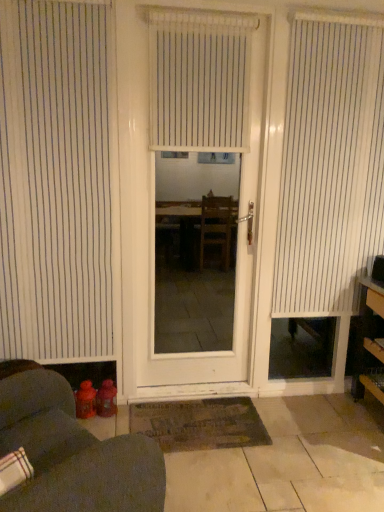
Describe the element at coordinates (330, 166) in the screenshot. I see `white vertical blinds at right, the 3th window blind positioned from the left` at that location.

Where is `white striped blind at lower left, arranged as the third window blind when viewed from the right`? This screenshot has width=384, height=512. white striped blind at lower left, arranged as the third window blind when viewed from the right is located at coordinates (55, 180).

Describe the element at coordinates (369, 341) in the screenshot. Image resolution: width=384 pixels, height=512 pixels. I see `wooden shelves at right` at that location.

What do you see at coordinates (71, 451) in the screenshot?
I see `matte red water bottles at lower left` at bounding box center [71, 451].

Locate an element on the screen. Image resolution: width=384 pixels, height=512 pixels. white vertical blinds at right, the 3th window blind positioned from the left is located at coordinates (330, 166).

Is white vertical blinds at center, the second window blind in the right-to-left sequence, at the right side of dark brown textured mat at center?

Correct, you'll find white vertical blinds at center, the second window blind in the right-to-left sequence, to the right of dark brown textured mat at center.

Is white vertical blinds at center, which ranks as the second window blind in left-to-right order, closer to camera compared to dark brown textured mat at center?

Yes, white vertical blinds at center, which ranks as the second window blind in left-to-right order, is closer to the camera.

From the image's perspective, is white vertical blinds at center, the second window blind in the right-to-left sequence, positioned above or below dark brown textured mat at center?

white vertical blinds at center, the second window blind in the right-to-left sequence, is situated higher than dark brown textured mat at center in the image.

Which is in front, point (199, 122) or point (198, 418)?

Point (199, 122)

Does white matte door at center turn towards white vertical blinds at right, which ranks as the 1th window blind in right-to-left order?

No.

Does point (162, 158) appear closer or farther from the camera than point (361, 21)?

Clearly, point (162, 158) is more distant from the camera than point (361, 21).

Considering the relative sizes of white matte door at center and white vertical blinds at right, which ranks as the 1th window blind in right-to-left order, in the image provided, is white matte door at center thinner than white vertical blinds at right, which ranks as the 1th window blind in right-to-left order,?

Yes.

Can you confirm if dark brown textured mat at center is positioned to the left of white striped blind at lower left, arranged as the third window blind when viewed from the right?

Incorrect, dark brown textured mat at center is not on the left side of white striped blind at lower left, arranged as the third window blind when viewed from the right.

From their relative heights in the image, would you say dark brown textured mat at center is taller or shorter than white striped blind at lower left, arranged as the third window blind when viewed from the right?

dark brown textured mat at center is shorter than white striped blind at lower left, arranged as the third window blind when viewed from the right.

Considering their positions, is dark brown textured mat at center located in front of or behind white striped blind at lower left, arranged as the third window blind when viewed from the right?

Visually, dark brown textured mat at center is located behind white striped blind at lower left, arranged as the third window blind when viewed from the right.

Is dark brown textured mat at center smaller than white striped blind at lower left, the 1th window blind when ordered from left to right?

Yes.

Is dark brown textured mat at center taller than white vertical blinds at center, the second window blind in the right-to-left sequence?

No.

Based on the photo, which object is closer to the camera taking this photo, dark brown textured mat at center or white vertical blinds at center, which ranks as the second window blind in left-to-right order?

white vertical blinds at center, which ranks as the second window blind in left-to-right order, is in front.

From the picture: Who is smaller, dark brown textured mat at center or white vertical blinds at center, the second window blind in the right-to-left sequence?

dark brown textured mat at center is smaller.

What's the angular difference between dark brown textured mat at center and white vertical blinds at center, which ranks as the second window blind in left-to-right order,'s facing directions?

dark brown textured mat at center and white vertical blinds at center, which ranks as the second window blind in left-to-right order, are facing 0.246 degrees away from each other.

Does dark brown textured mat at center have a lesser width compared to white vertical blinds at right, which ranks as the 1th window blind in right-to-left order?

In fact, dark brown textured mat at center might be wider than white vertical blinds at right, which ranks as the 1th window blind in right-to-left order.

Is dark brown textured mat at center positioned far away from white vertical blinds at right, the 3th window blind positioned from the left?

That's right, there is a large distance between dark brown textured mat at center and white vertical blinds at right, the 3th window blind positioned from the left.

Does point (191, 429) lie in front of point (302, 42)?

No, it is behind (302, 42).

Is wooden shelves at right inside white matte door at center?

No, wooden shelves at right is not surrounded by white matte door at center.

Is white matte door at center positioned with its back to wooden shelves at right?

No.

Which is more to the right, white matte door at center or wooden shelves at right?

From the viewer's perspective, wooden shelves at right appears more on the right side.

Is the position of white matte door at center less distant than that of wooden shelves at right?

No.

Considering the positions of objects white vertical blinds at center, which ranks as the second window blind in left-to-right order, and white matte door at center in the image provided, who is behind, white vertical blinds at center, which ranks as the second window blind in left-to-right order, or white matte door at center?

Positioned behind is white vertical blinds at center, which ranks as the second window blind in left-to-right order.

Is white vertical blinds at center, the second window blind in the right-to-left sequence, oriented away from white matte door at center?

Yes.

Looking at this image, are white vertical blinds at center, the second window blind in the right-to-left sequence, and white matte door at center located far from each other?

Absolutely, white vertical blinds at center, the second window blind in the right-to-left sequence, is distant from white matte door at center.

Could you measure the distance between white vertical blinds at center, which ranks as the second window blind in left-to-right order, and white matte door at center?

6.28 feet.

Starting from the dark brown textured mat at center, which window blind is the 1st one to the right? Please provide its 2D coordinates.

[(199, 80)]

Identify the location of door that appears in front of the white vertical blinds at right, the 3th window blind positioned from the left. (202, 190).

From the image, which object appears to be nearer to white striped blind at lower left, the 1th window blind when ordered from left to right, white vertical blinds at center, the second window blind in the right-to-left sequence, or dark brown textured mat at center?

The object closer to white striped blind at lower left, the 1th window blind when ordered from left to right, is white vertical blinds at center, the second window blind in the right-to-left sequence.

When comparing their distances from white striped blind at lower left, the 1th window blind when ordered from left to right, does wooden shelves at right or white vertical blinds at center, the second window blind in the right-to-left sequence, seem further?

wooden shelves at right lies further to white striped blind at lower left, the 1th window blind when ordered from left to right, than the other object.

When comparing their distances from white vertical blinds at center, the second window blind in the right-to-left sequence, does matte red water bottles at lower left or white vertical blinds at right, which ranks as the 1th window blind in right-to-left order, seem further?

matte red water bottles at lower left is positioned further to the anchor white vertical blinds at center, the second window blind in the right-to-left sequence.

Considering their positions, is white matte door at center positioned closer to white vertical blinds at right, the 3th window blind positioned from the left, than white vertical blinds at center, the second window blind in the right-to-left sequence?

The object closer to white vertical blinds at right, the 3th window blind positioned from the left, is white vertical blinds at center, the second window blind in the right-to-left sequence.

Looking at the image, which one is located further to white vertical blinds at center, the second window blind in the right-to-left sequence, wooden shelves at right or white vertical blinds at right, which ranks as the 1th window blind in right-to-left order?

Among the two, wooden shelves at right is located further to white vertical blinds at center, the second window blind in the right-to-left sequence.

When comparing their distances from white vertical blinds at right, which ranks as the 1th window blind in right-to-left order, does white striped blind at lower left, arranged as the third window blind when viewed from the right, or white matte door at center seem closer?

The object closer to white vertical blinds at right, which ranks as the 1th window blind in right-to-left order, is white striped blind at lower left, arranged as the third window blind when viewed from the right.

Estimate the real-world distances between objects in this image. Which object is closer to white matte door at center, white vertical blinds at right, which ranks as the 1th window blind in right-to-left order, or matte red water bottles at lower left?

Among the two, white vertical blinds at right, which ranks as the 1th window blind in right-to-left order, is located nearer to white matte door at center.

Considering their positions, is white vertical blinds at right, which ranks as the 1th window blind in right-to-left order, positioned closer to matte red water bottles at lower left than dark brown textured mat at center?

Based on the image, dark brown textured mat at center appears to be nearer to matte red water bottles at lower left.

Where is `doormat between matte red water bottles at lower left and wooden shelves at right in the horizontal direction`? The width and height of the screenshot is (384, 512). doormat between matte red water bottles at lower left and wooden shelves at right in the horizontal direction is located at coordinates (200, 424).

I want to click on door between matte red water bottles at lower left and white vertical blinds at right, which ranks as the 1th window blind in right-to-left order, from left to right, so click(202, 190).

Where is `door between white vertical blinds at right, which ranks as the 1th window blind in right-to-left order, and dark brown textured mat at center in the up-down direction`? The height and width of the screenshot is (512, 384). door between white vertical blinds at right, which ranks as the 1th window blind in right-to-left order, and dark brown textured mat at center in the up-down direction is located at coordinates coord(202,190).

In order to click on furniture located between white striped blind at lower left, the 1th window blind when ordered from left to right, and wooden shelves at right in the left-right direction in this screenshot , I will do `click(71, 451)`.